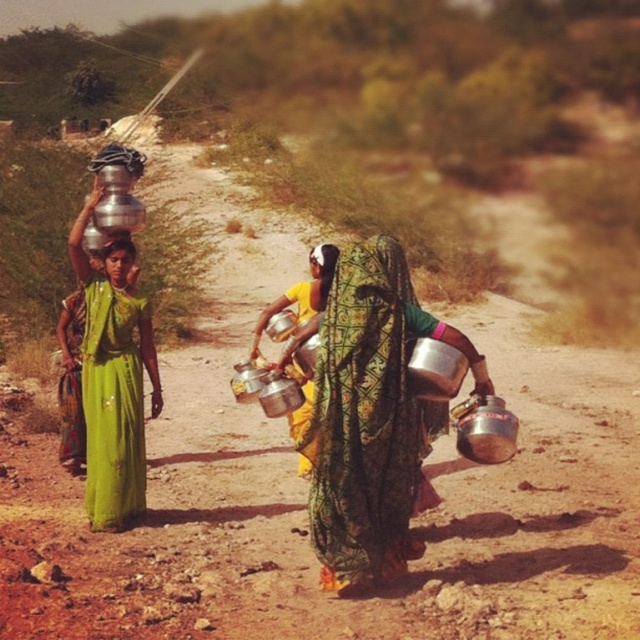
You are a photographer taking a picture of the three women carrying pots. You notice the shiny metallic pot at center and the matte silver water at left in your viewfinder. Which object appears lower in the frame?

The shiny metallic pot at center appears lower in the frame because it is located below the matte silver water at left according to the description.

You are standing at the point marked by the coordinate (371,417) in the image. What object is located exactly at this coordinate?

The shiny metallic pot at center is located exactly at the coordinate point (371,417).

You are a photographer trying to capture the scene. You want to ensure that both the shiny metallic pot at center and the matte green dress at center are in focus. Given that your camera can only focus on objects within a 1 meter width, can both objects be in focus simultaneously?

The shiny metallic pot at center might be wider than matte green dress at center, so it is uncertain if both can be in focus within the 1 meter width. You may need to adjust your camera settings or focus on one object primarily.